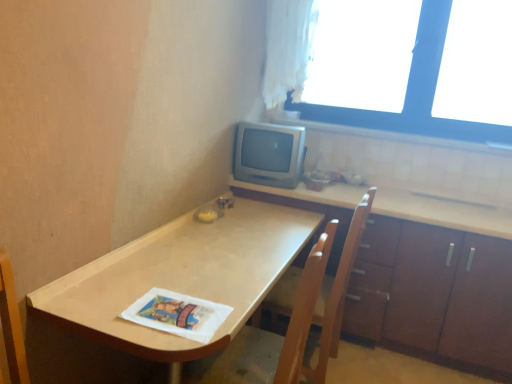
This screenshot has height=384, width=512. I want to click on unoccupied area behind white paper magazine at lower center, so click(x=189, y=281).